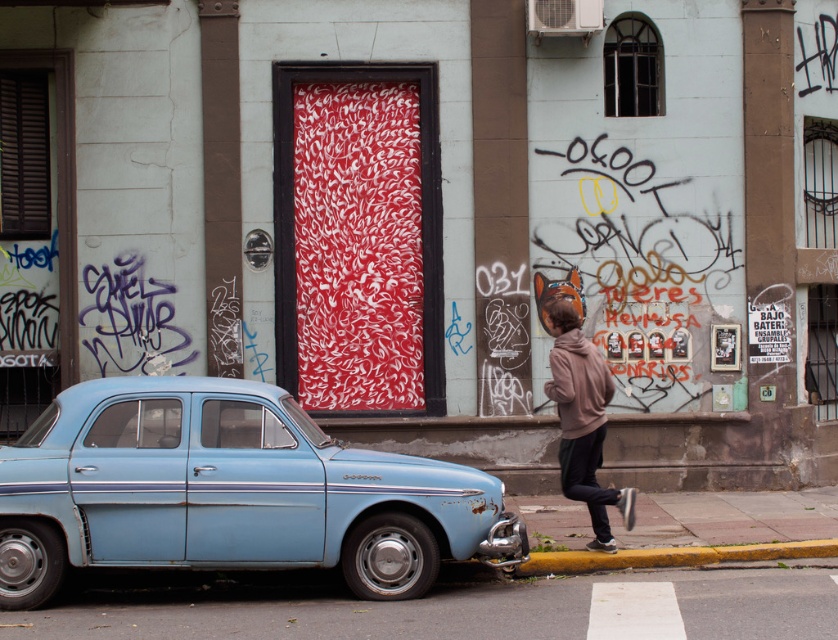
Question: Is light blue metallic car at left smaller than brown hoodie at center?

Choices:
 (A) no
 (B) yes

Answer: (A)

Question: Observing the image, what is the correct spatial positioning of light blue metallic car at left in reference to brown hoodie at center?

Choices:
 (A) left
 (B) right

Answer: (A)

Question: Which of the following is the closest to the observer?

Choices:
 (A) (588, 554)
 (B) (260, 448)
 (C) (593, 518)

Answer: (B)

Question: Is light blue metallic car at left positioned at the back of brown hoodie at center?

Choices:
 (A) no
 (B) yes

Answer: (A)

Question: Which object appears farthest from the camera in this image?

Choices:
 (A) brown hoodie at center
 (B) light blue metallic car at left

Answer: (A)

Question: Among these objects, which one is farthest from the camera?

Choices:
 (A) brown hoodie at center
 (B) yellow painted concrete curb at lower right

Answer: (A)